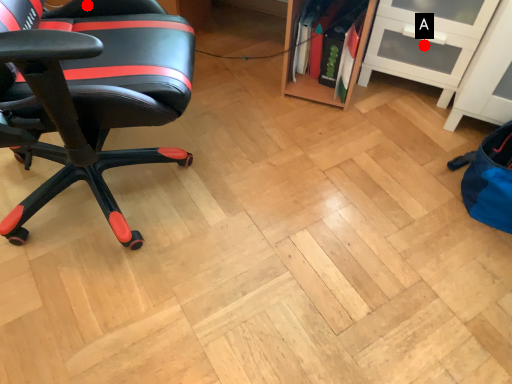
Question: Two points are circled on the image, labeled by A and B beside each circle. Which point is farther to the camera?

Choices:
 (A) A is further
 (B) B is further

Answer: (A)